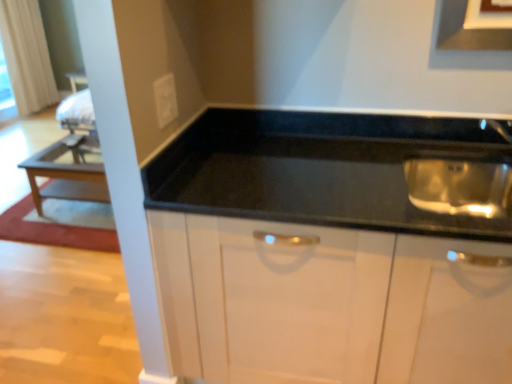
Question: Does point (39, 200) appear closer or farther from the camera than point (4, 36)?

Choices:
 (A) farther
 (B) closer

Answer: (B)

Question: In terms of height, does wooden table at left look taller or shorter compared to white fabric curtain at upper left?

Choices:
 (A) short
 (B) tall

Answer: (A)

Question: Which of these objects is positioned closest to the matte black exhaust hood at upper center?

Choices:
 (A) white fabric curtain at upper left
 (B) wooden table at left
 (C) black glossy cabinet at center

Answer: (C)

Question: Estimate the real-world distances between objects in this image. Which object is closer to the white fabric curtain at upper left?

Choices:
 (A) black glossy cabinet at center
 (B) wooden table at left
 (C) matte black exhaust hood at upper center

Answer: (B)